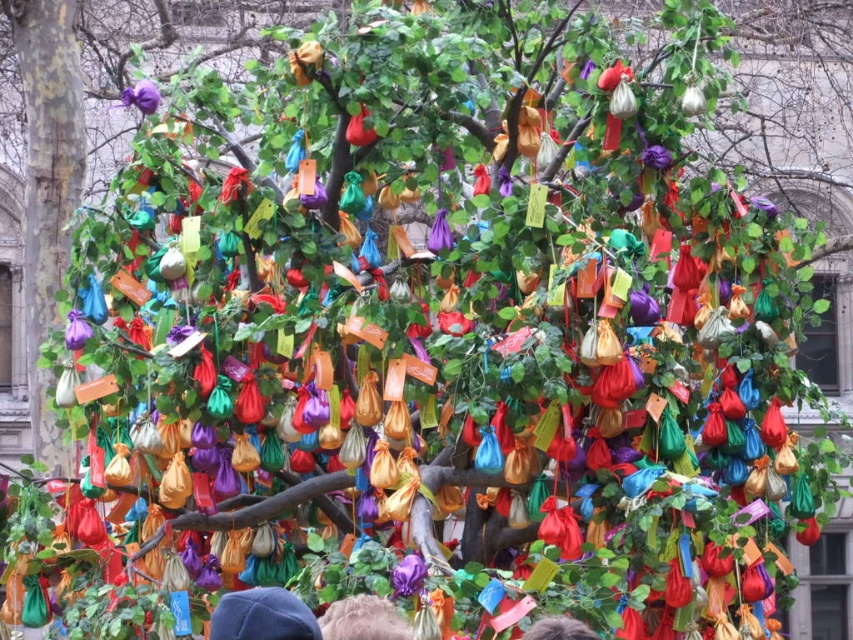
Can you confirm if blue fabric cap at center is wider than fuzzy brown hair at center?

Indeed, blue fabric cap at center has a greater width compared to fuzzy brown hair at center.

Identify the location of blue fabric cap at center. This screenshot has width=853, height=640. pos(262,616).

Does blue fabric cap at center have a larger size compared to gray hair at center?

Indeed, blue fabric cap at center has a larger size compared to gray hair at center.

The height and width of the screenshot is (640, 853). Describe the element at coordinates (262, 616) in the screenshot. I see `blue fabric cap at center` at that location.

Where is `blue fabric cap at center`? This screenshot has width=853, height=640. blue fabric cap at center is located at coordinates (262, 616).

Is fuzzy brown hair at center closer to the viewer compared to gray hair at center?

Yes, fuzzy brown hair at center is in front of gray hair at center.

Which is in front, point (347, 612) or point (547, 616)?

Point (347, 612) is more forward.

This screenshot has width=853, height=640. What are the coordinates of `fuzzy brown hair at center` in the screenshot? It's located at (364, 620).